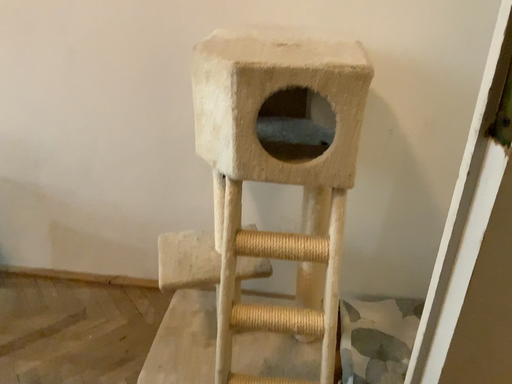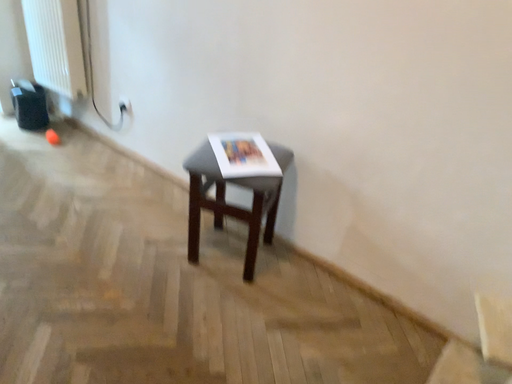
Question: How did the camera likely rotate when shooting the video?

Choices:
 (A) rotated left
 (B) rotated right

Answer: (A)